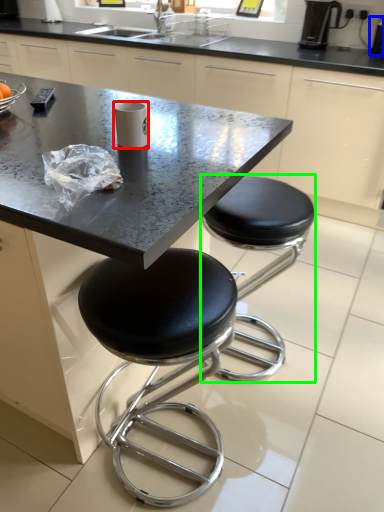
Question: Which is farther away from paper cup (highlighted by a red box)? appliance (highlighted by a blue box) or stool (highlighted by a green box)?

Choices:
 (A) appliance
 (B) stool

Answer: (A)